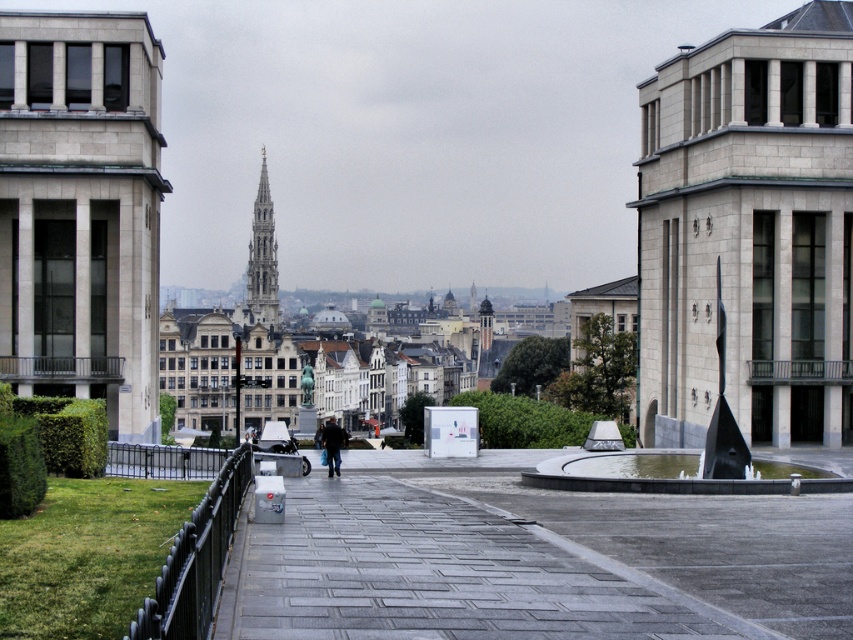
You are a city planner reviewing the plaza layout. You need to place a new bench that requires 2 square meters of space. Given the gray concrete pavement at center and the smooth stone spire at center, which object can accommodate the bench?

The smooth stone spire at center is larger than the gray concrete pavement at center, so the bench can be placed on the smooth stone spire at center if it has enough space. However, since the question specifies the bench requires 2 square meters, and the description only mentions size comparison, it might not be possible without exact measurements. But based on the given info, the smooth stone spire at center is the better option.

You are standing at the plaza and want to walk from the gray concrete pavement at center to the smooth stone spire at center. Which direction should you move?

You should move to the left to reach the smooth stone spire at center from the gray concrete pavement at center since the pavement is on the right side of the spire.